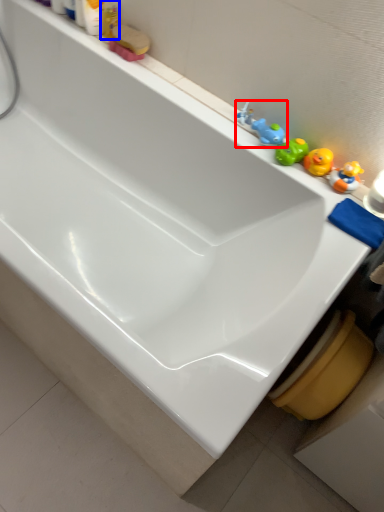
Question: Which point is closer to the camera, toy (highlighted by a red box) or toiletry (highlighted by a blue box)?

Choices:
 (A) toy
 (B) toiletry

Answer: (A)